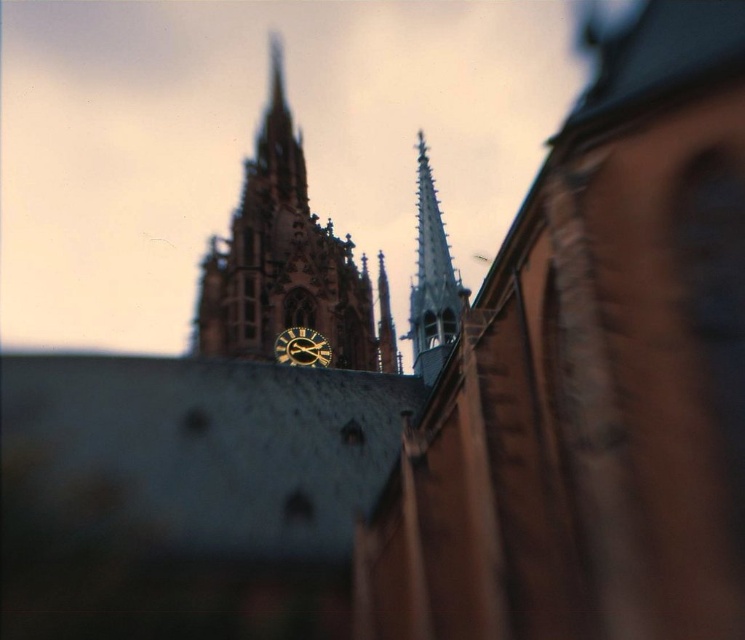
Question: Which object is the closest to the smooth gray spire at center?

Choices:
 (A) golden stone clock tower at center
 (B) gold metallic clock at center

Answer: (B)

Question: Estimate the real-world distances between objects in this image. Which object is closer to the gold metallic clock at center?

Choices:
 (A) smooth gray spire at center
 (B) golden stone clock tower at center

Answer: (B)

Question: Estimate the real-world distances between objects in this image. Which object is closer to the gold metallic clock at center?

Choices:
 (A) golden stone clock tower at center
 (B) smooth gray spire at center

Answer: (A)

Question: Can you confirm if golden stone clock tower at center is positioned to the left of smooth gray spire at center?

Choices:
 (A) no
 (B) yes

Answer: (B)

Question: Does golden stone clock tower at center have a larger size compared to smooth gray spire at center?

Choices:
 (A) no
 (B) yes

Answer: (B)

Question: Can you confirm if smooth gray spire at center is positioned to the left of gold metallic clock at center?

Choices:
 (A) no
 (B) yes

Answer: (A)